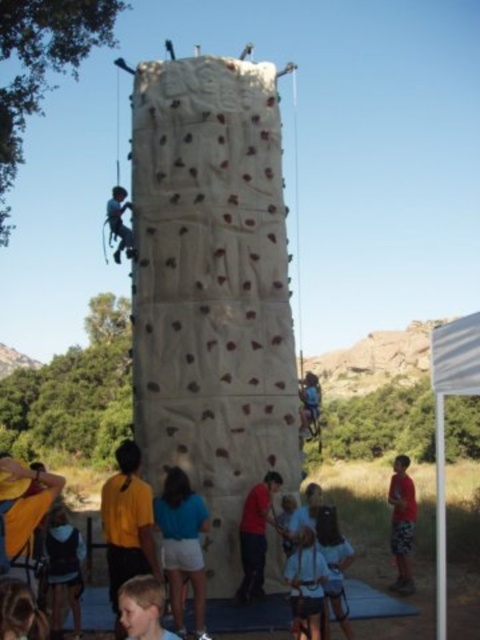
Does white fabric canopy at right have a greater height compared to matte blue shirt at lower center?

Yes.

Describe the element at coordinates (444, 422) in the screenshot. The image size is (480, 640). I see `white fabric canopy at right` at that location.

Where is `white fabric canopy at right`? Image resolution: width=480 pixels, height=640 pixels. white fabric canopy at right is located at coordinates (444, 422).

Can you confirm if matte blue shirt at lower center is shorter than matte blue harness at upper center?

Correct, matte blue shirt at lower center is not as tall as matte blue harness at upper center.

Locate an element on the screen. This screenshot has height=640, width=480. matte blue shirt at lower center is located at coordinates (305, 586).

Who is more forward, (416,506) or (126,252)?

Positioned in front is point (126,252).

Between red cotton shorts at lower right and matte blue harness at upper center, which one is positioned higher?

Positioned higher is matte blue harness at upper center.

Which is behind, point (396, 548) or point (133, 244)?

Point (396, 548)

Locate an element on the screen. This screenshot has height=640, width=480. red cotton shorts at lower right is located at coordinates (402, 524).